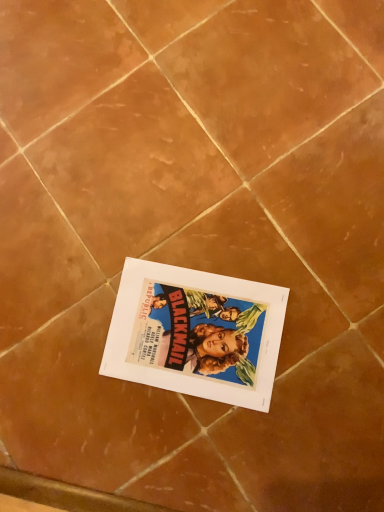
Where is `vacant space in matte paper poster at center (from a real-world perspective)`? vacant space in matte paper poster at center (from a real-world perspective) is located at coordinates (189, 331).